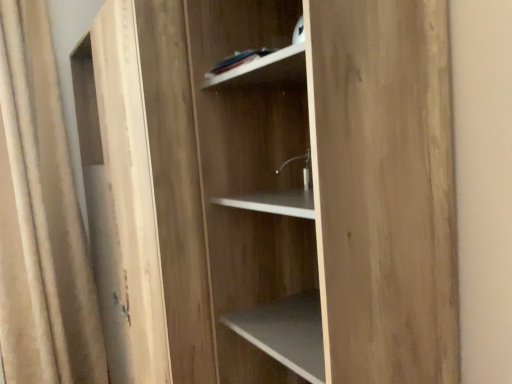
Question: Relative to light brown wood at center, is white matte shelf at upper center in front or behind?

Choices:
 (A) front
 (B) behind

Answer: (B)

Question: Is white matte shelf at upper center bigger or smaller than light brown wood at center?

Choices:
 (A) small
 (B) big

Answer: (A)

Question: Which object is the farthest from the light brown wood at center?

Choices:
 (A) light wood cabinet at center
 (B) white matte shelf at upper center
 (C) beige fabric curtain at left

Answer: (C)

Question: Estimate the real-world distances between objects in this image. Which object is farther from the light wood cabinet at center?

Choices:
 (A) white matte shelf at upper center
 (B) light brown wood at center
 (C) beige fabric curtain at left

Answer: (C)